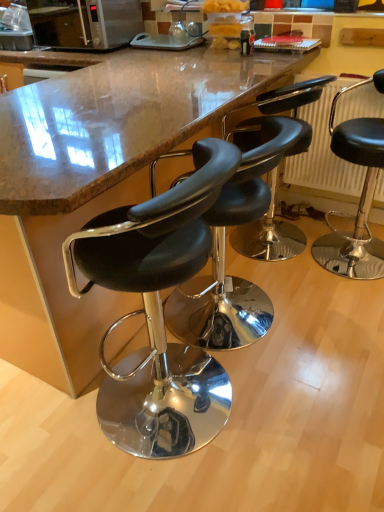
This screenshot has height=512, width=384. I want to click on black leather stool at center, positioned as the first chair in left-to-right order, so click(158, 313).

I want to click on marble countertop at center, so click(97, 182).

Find the location of a particular element. black leather stool at center, which is the 2th chair from right to left is located at coordinates (283, 116).

The height and width of the screenshot is (512, 384). What do you see at coordinates (360, 196) in the screenshot? I see `black leather stool at right, which is the fourth chair in left-to-right order` at bounding box center [360, 196].

This screenshot has height=512, width=384. Find the location of `metallic silver microwave at upper left`. metallic silver microwave at upper left is located at coordinates (85, 23).

Between black leather stool at right, which is the fourth chair in left-to-right order, and black leather stool at center, which appears as the 2th chair when viewed from the left, which one has smaller width?

With smaller width is black leather stool at right, which is the fourth chair in left-to-right order.

Is black leather stool at right, arranged as the 1th chair when viewed from the right, outside of black leather stool at center, which appears as the 2th chair when viewed from the left?

Yes.

Consider the image. From the image's perspective, relative to black leather stool at center, which is the third chair in right-to-left order, is black leather stool at right, which is the fourth chair in left-to-right order, above or below?

black leather stool at right, which is the fourth chair in left-to-right order, is situated higher than black leather stool at center, which is the third chair in right-to-left order, in the image.

How many degrees apart are the facing directions of black leather stool at right, arranged as the 1th chair when viewed from the right, and black leather stool at center, which is the third chair in right-to-left order?

black leather stool at right, arranged as the 1th chair when viewed from the right, and black leather stool at center, which is the third chair in right-to-left order, are facing 1.23 degrees away from each other.

Considering the positions of points (238, 344) and (151, 412), is point (238, 344) farther from camera compared to point (151, 412)?

Yes, point (238, 344) is behind point (151, 412).

From a real-world perspective, between black leather stool at center, which is the third chair in right-to-left order, and black leather stool at center, which is the fourth chair in right-to-left order, who is vertically lower?

black leather stool at center, which is the third chair in right-to-left order.

How many degrees apart are the facing directions of black leather stool at center, which appears as the 2th chair when viewed from the left, and black leather stool at center, positioned as the first chair in left-to-right order?

The angular difference between black leather stool at center, which appears as the 2th chair when viewed from the left, and black leather stool at center, positioned as the first chair in left-to-right order, is 0.00152 degrees.

Are black leather stool at center, which is the third chair in right-to-left order, and black leather stool at center, positioned as the first chair in left-to-right order, beside each other?

black leather stool at center, which is the third chair in right-to-left order, is not next to black leather stool at center, positioned as the first chair in left-to-right order, and they're not touching.

From a real-world perspective, is metallic radiator at right over black leather stool at center, which is the fourth chair in right-to-left order?

Yes, from a real-world perspective, metallic radiator at right is on top of black leather stool at center, which is the fourth chair in right-to-left order.

Is the surface of metallic radiator at right in direct contact with black leather stool at center, which is the fourth chair in right-to-left order?

No, metallic radiator at right is not making contact with black leather stool at center, which is the fourth chair in right-to-left order.

Is point (373, 111) less distant than point (119, 269)?

No.

Based on the photo, is marble countertop at center smaller than black leather stool at center, which is counted as the 3th chair, starting from the left?

No, marble countertop at center is not smaller than black leather stool at center, which is counted as the 3th chair, starting from the left.

Between point (181, 116) and point (291, 118), which one is positioned in front?

The point (181, 116) is more forward.

The image size is (384, 512). In order to click on counter in front of the black leather stool at center, which is counted as the 3th chair, starting from the left in this screenshot , I will do `click(97, 182)`.

Is marble countertop at center aimed at black leather stool at center, which is counted as the 3th chair, starting from the left?

No, marble countertop at center is not facing towards black leather stool at center, which is counted as the 3th chair, starting from the left.

Between black leather stool at center, which is counted as the 3th chair, starting from the left, and marble countertop at center, which one has smaller size?

Smaller between the two is black leather stool at center, which is counted as the 3th chair, starting from the left.

Is point (286, 234) more distant than point (156, 53)?

Yes, it is behind point (156, 53).

Consider the image. Does black leather stool at center, which is the 2th chair from right to left, turn towards marble countertop at center?

Yes, black leather stool at center, which is the 2th chair from right to left, is aimed at marble countertop at center.

Where is `counter above the black leather stool at center, which is the 2th chair from right to left (from a real-world perspective)`? counter above the black leather stool at center, which is the 2th chair from right to left (from a real-world perspective) is located at coordinates (97, 182).

Image resolution: width=384 pixels, height=512 pixels. Identify the location of appliance above the marble countertop at center (from the image's perspective). (85, 23).

Can we say marble countertop at center lies outside metallic silver microwave at upper left?

Yes.

Is black leather stool at center, which is the third chair in right-to-left order, placed right next to marble countertop at center?

No, black leather stool at center, which is the third chair in right-to-left order, is not touching marble countertop at center.

From their relative heights in the image, would you say black leather stool at center, which is the third chair in right-to-left order, is taller or shorter than marble countertop at center?

black leather stool at center, which is the third chair in right-to-left order, is shorter than marble countertop at center.

Measure the distance from black leather stool at center, which appears as the 2th chair when viewed from the left, to marble countertop at center.

The distance of black leather stool at center, which appears as the 2th chair when viewed from the left, from marble countertop at center is 25.62 inches.

Image resolution: width=384 pixels, height=512 pixels. I want to click on counter in front of the black leather stool at center, which is the third chair in right-to-left order, so click(97, 182).

The image size is (384, 512). I want to click on chair that is the 2nd object to the left of the black leather stool at right, arranged as the 1th chair when viewed from the right, starting at the anchor, so click(x=224, y=249).

Image resolution: width=384 pixels, height=512 pixels. What are the coordinates of `the 3rd chair below the black leather stool at center, which is the fourth chair in right-to-left order (from a real-world perspective)` in the screenshot? It's located at (224, 249).

Considering their positions, is marble countertop at center positioned further to black leather stool at center, which is the third chair in right-to-left order, than black leather stool at center, which is the 2th chair from right to left?

The object further to black leather stool at center, which is the third chair in right-to-left order, is marble countertop at center.

From the image, which object appears to be nearer to metallic radiator at right, metallic silver microwave at upper left or black leather stool at center, which is counted as the 3th chair, starting from the left?

black leather stool at center, which is counted as the 3th chair, starting from the left, is positioned closer to the anchor metallic radiator at right.

Considering their positions, is marble countertop at center positioned further to metallic silver microwave at upper left than black leather stool at right, arranged as the 1th chair when viewed from the right?

black leather stool at right, arranged as the 1th chair when viewed from the right, is positioned further to the anchor metallic silver microwave at upper left.

Looking at the image, which one is located closer to marble countertop at center, black leather stool at center, which is the fourth chair in right-to-left order, or metallic silver microwave at upper left?

Among the two, black leather stool at center, which is the fourth chair in right-to-left order, is located nearer to marble countertop at center.

Considering their positions, is marble countertop at center positioned closer to black leather stool at center, which is the fourth chair in right-to-left order, than black leather stool at center, which is counted as the 3th chair, starting from the left?

Among the two, marble countertop at center is located nearer to black leather stool at center, which is the fourth chair in right-to-left order.

From the image, which object appears to be farther from black leather stool at center, which is the 2th chair from right to left, black leather stool at right, arranged as the 1th chair when viewed from the right, or metallic silver microwave at upper left?

metallic silver microwave at upper left is positioned further to the anchor black leather stool at center, which is the 2th chair from right to left.

Based on their spatial positions, is black leather stool at center, positioned as the first chair in left-to-right order, or metallic radiator at right closer to black leather stool at right, which is the fourth chair in left-to-right order?

metallic radiator at right is positioned closer to the anchor black leather stool at right, which is the fourth chair in left-to-right order.

Looking at the image, which one is located further to metallic silver microwave at upper left, metallic radiator at right or marble countertop at center?

metallic radiator at right is positioned further to the anchor metallic silver microwave at upper left.

Locate an element on the screen. The height and width of the screenshot is (512, 384). radiator situated between black leather stool at center, which is the third chair in right-to-left order, and black leather stool at right, arranged as the 1th chair when viewed from the right, from left to right is located at coordinates (324, 152).

This screenshot has width=384, height=512. I want to click on radiator between marble countertop at center and black leather stool at right, arranged as the 1th chair when viewed from the right, in the horizontal direction, so [324, 152].

What are the coordinates of `counter between metallic silver microwave at upper left and black leather stool at right, arranged as the 1th chair when viewed from the right` in the screenshot? It's located at (97, 182).

Find the location of `radiator located between black leather stool at center, which is counted as the 3th chair, starting from the left, and black leather stool at right, which is the fourth chair in left-to-right order, in the left-right direction`. radiator located between black leather stool at center, which is counted as the 3th chair, starting from the left, and black leather stool at right, which is the fourth chair in left-to-right order, in the left-right direction is located at coordinates (324, 152).